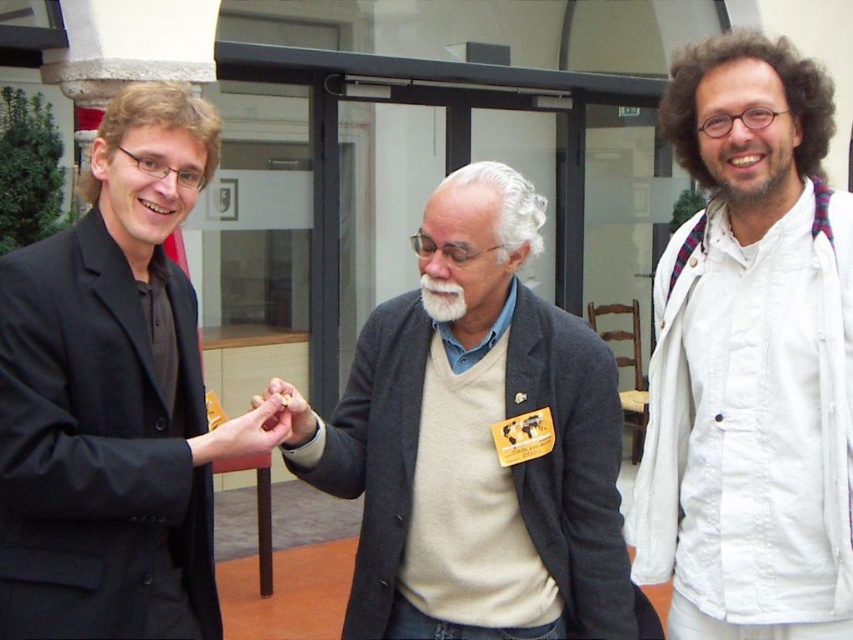
Who is positioned more to the left, beige sweater at center or matte brown paper at center?

matte brown paper at center

Does beige sweater at center appear over matte brown paper at center?

Actually, beige sweater at center is below matte brown paper at center.

Locate an element on the screen. This screenshot has height=640, width=853. beige sweater at center is located at coordinates (479, 445).

Where is `beige sweater at center`? The image size is (853, 640). beige sweater at center is located at coordinates (479, 445).

Who is positioned more to the left, white cotton shirt at right or matte gold ring at center?

matte gold ring at center

Who is positioned more to the right, white cotton shirt at right or matte gold ring at center?

white cotton shirt at right

Does point (689, 548) come behind point (196, 440)?

Yes, point (689, 548) is farther from viewer.

Where is `white cotton shirt at right`? The height and width of the screenshot is (640, 853). white cotton shirt at right is located at coordinates click(x=750, y=372).

Can you confirm if beige sweater at center is positioned below beardsoft hair at right?

Yes.

Is the position of beige sweater at center more distant than that of beardsoft hair at right?

That is True.

Find the location of a particular element. beige sweater at center is located at coordinates (479, 445).